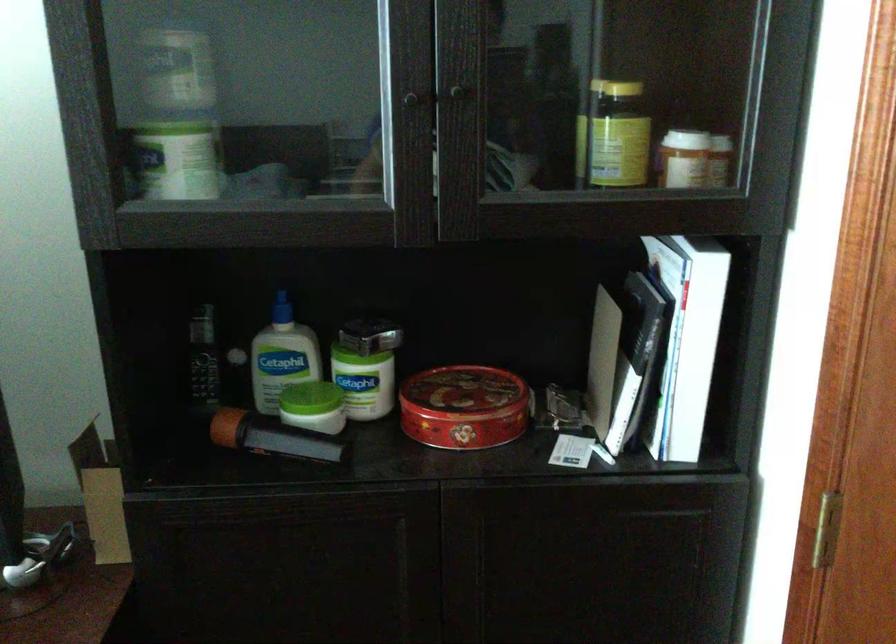
You are a GUI agent. You are given a task and a screenshot of the screen. Output one action in this format:
    pyautogui.click(x=<x>, y=<y>)
    Task: Click on the cordless phone handset
    
    Given the screenshot: What is the action you would take?
    pyautogui.click(x=202, y=357)